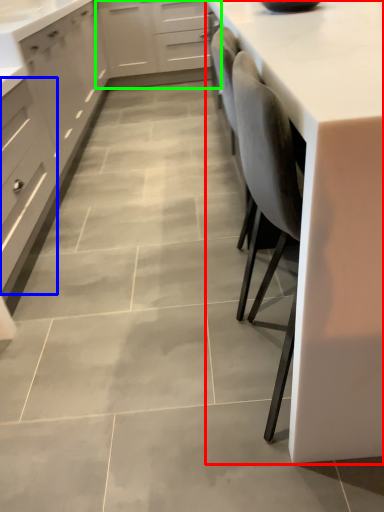
Question: Which is farther away from countertop (highlighted by a red box)? drawer (highlighted by a blue box) or cabinetry (highlighted by a green box)?

Choices:
 (A) drawer
 (B) cabinetry

Answer: (B)